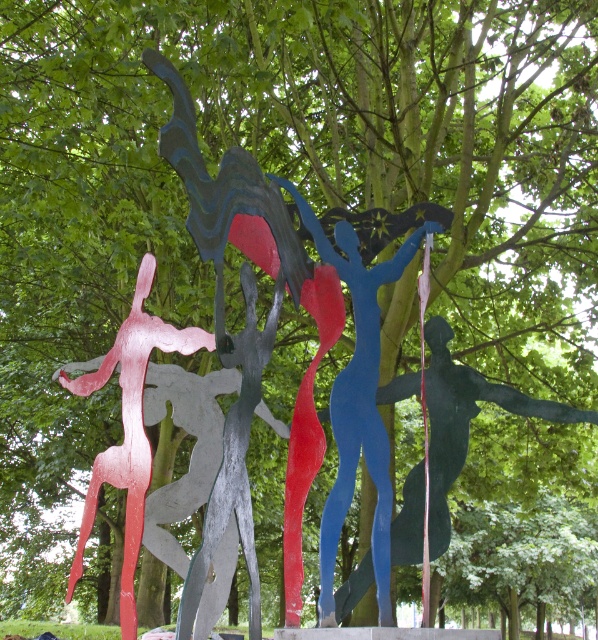
Question: Does blue glossy figure at center have a lesser width compared to metallic pink figure at left?

Choices:
 (A) no
 (B) yes

Answer: (A)

Question: Which of the following is the farthest from the observer?

Choices:
 (A) metallic blue figure at center
 (B) blue glossy figure at center
 (C) metallic pink figure at left

Answer: (B)

Question: Estimate the real-world distances between objects in this image. Which object is farther from the metallic pink figure at left?

Choices:
 (A) blue glossy figure at center
 (B) metallic blue figure at center

Answer: (A)

Question: Can you confirm if metallic blue figure at center is positioned above blue glossy figure at center?

Choices:
 (A) yes
 (B) no

Answer: (A)

Question: Which object appears farthest from the camera in this image?

Choices:
 (A) metallic pink figure at left
 (B) blue glossy figure at center
 (C) metallic blue figure at center

Answer: (B)

Question: Can you confirm if metallic blue figure at center is wider than metallic pink figure at left?

Choices:
 (A) no
 (B) yes

Answer: (A)